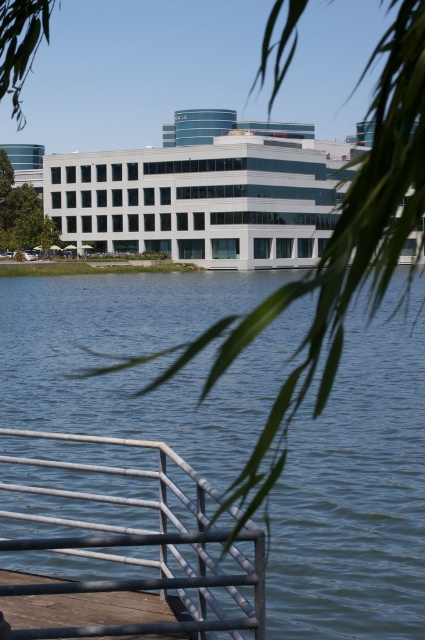
Who is lower down, silver metallic rail at lower left or brown wooden dock at lower left?

silver metallic rail at lower left

In the scene shown: Can you confirm if silver metallic rail at lower left is positioned to the left of brown wooden dock at lower left?

Yes, silver metallic rail at lower left is to the left of brown wooden dock at lower left.

Does point (31, 486) come behind point (102, 620)?

Yes, point (31, 486) is farther from viewer.

Find the location of `silver metallic rail at lower left`. silver metallic rail at lower left is located at coordinates (124, 548).

Is blue water at lower center closer to camera compared to silver metallic rail at lower left?

Yes, blue water at lower center is closer to the viewer.

Between point (39, 280) and point (206, 492), which one is positioned in front?

Point (206, 492) is in front.

Is point (374, 497) in front of point (71, 476)?

Yes, point (374, 497) is closer to viewer.

This screenshot has width=425, height=640. In order to click on blue water at lower center in this screenshot , I will do `click(354, 499)`.

Is point (311, 570) positioned before point (79, 604)?

That is False.

Can you confirm if blue water at lower center is positioned to the left of brown wooden dock at lower left?

Yes, blue water at lower center is to the left of brown wooden dock at lower left.

Who is more distant from viewer, (370, 608) or (37, 618)?

Point (370, 608)

What are the coordinates of `blue water at lower center` in the screenshot? It's located at (354, 499).